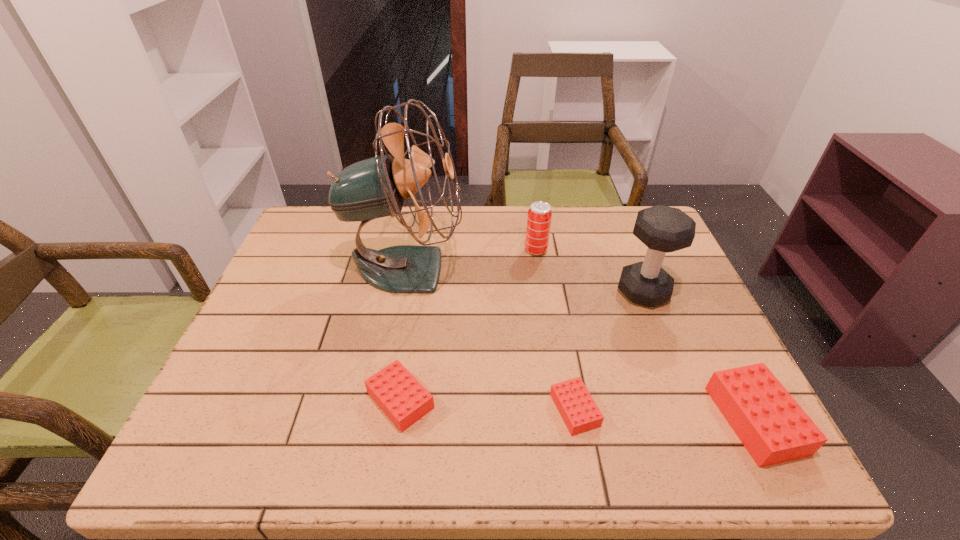
Where is `the fifth tallest object`? The height and width of the screenshot is (540, 960). the fifth tallest object is located at coordinates (396, 391).

At what (x,y) coordinates should I click in order to perform the action: click on the leftmost Lego. Please return your answer as a coordinate pair (x, y). The height and width of the screenshot is (540, 960). Looking at the image, I should click on (396, 391).

The width and height of the screenshot is (960, 540). In order to click on the second Lego from right to left in this screenshot , I will do `click(575, 404)`.

You are a GUI agent. You are given a task and a screenshot of the screen. Output one action in this format:
    pyautogui.click(x=<x>, y=<y>)
    Task: Click on the shortest object
    
    Given the screenshot: What is the action you would take?
    pyautogui.click(x=575, y=404)

You are a GUI agent. You are given a task and a screenshot of the screen. Output one action in this format:
    pyautogui.click(x=<x>, y=<y>)
    Task: Click on the rightmost Lego
    
    Given the screenshot: What is the action you would take?
    click(771, 425)

This screenshot has height=540, width=960. I want to click on the fourth tallest object, so click(771, 425).

At what (x,y) coordinates should I click in order to perform the action: click on soda can. Please return your answer as a coordinate pair (x, y). The image size is (960, 540). Looking at the image, I should click on (539, 217).

You are a GUI agent. You are given a task and a screenshot of the screen. Output one action in this format:
    pyautogui.click(x=<x>, y=<y>)
    Task: Click on the fan
    The width and height of the screenshot is (960, 540).
    Given the screenshot: What is the action you would take?
    pyautogui.click(x=376, y=187)

The width and height of the screenshot is (960, 540). I want to click on dumbbell, so click(x=663, y=229).

Where is `free point located on the back of the fifth tallest object`? This screenshot has width=960, height=540. free point located on the back of the fifth tallest object is located at coordinates (419, 282).